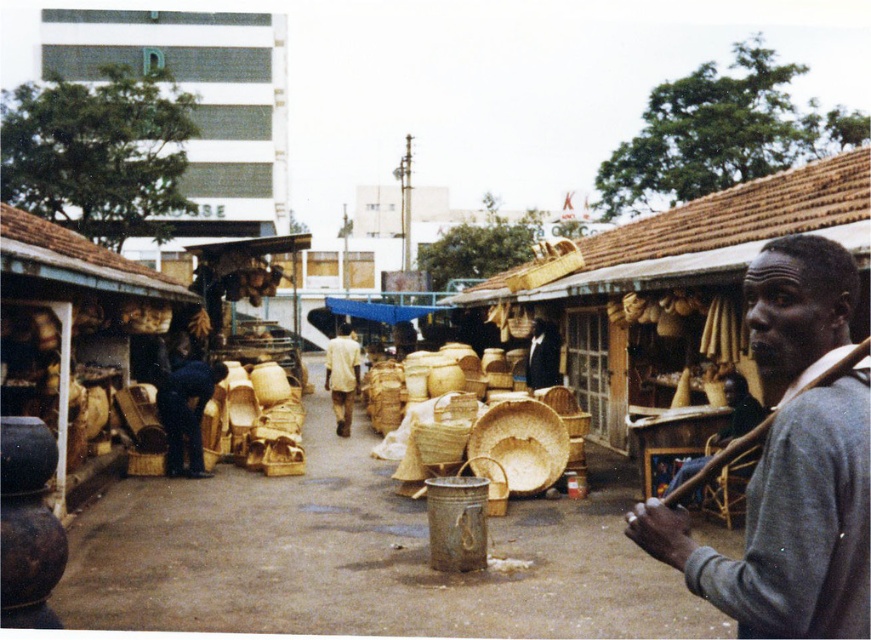
Question: Among these points, which one is farthest from the camera?

Choices:
 (A) (734, 404)
 (B) (815, 515)
 (C) (172, 420)

Answer: (C)

Question: Considering the relative positions of light brown woven basket at center and natural woven basket at center in the image provided, where is light brown woven basket at center located with respect to natural woven basket at center?

Choices:
 (A) above
 (B) below

Answer: (B)

Question: Which object is the farthest from the dark gray sweater at right?

Choices:
 (A) dark blue jeans at lower left
 (B) gray wool sweater at center
 (C) light brown woven basket at center

Answer: (C)

Question: Does gray wool sweater at center have a lesser width compared to natural woven basket at center?

Choices:
 (A) no
 (B) yes

Answer: (B)

Question: Which object is positioned closest to the natural woven basket at center?

Choices:
 (A) light brown woven basket at center
 (B) dark blue jeans at lower left
 (C) gray wool sweater at center

Answer: (A)

Question: Is gray wool sweater at center positioned before natural woven basket at center?

Choices:
 (A) no
 (B) yes

Answer: (B)